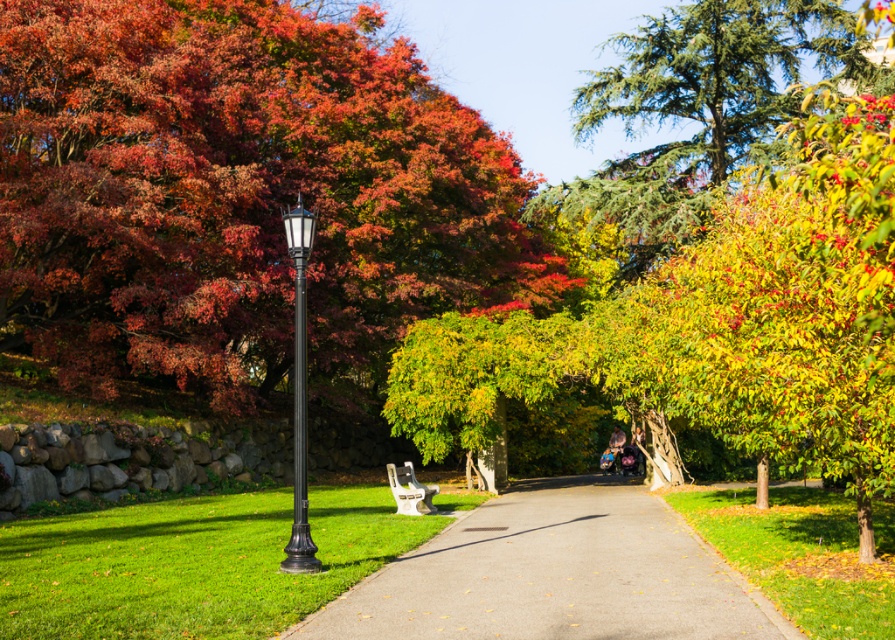
Does smooth asphalt path at center have a greater width compared to white plastic bench at center?

Yes.

Is point (638, 532) closer to camera compared to point (394, 493)?

Yes.

Which is in front, point (458, 550) or point (411, 508)?

Point (458, 550) is more forward.

Locate an element on the screen. The image size is (895, 640). smooth asphalt path at center is located at coordinates (555, 576).

Can you confirm if autumn leaves at upper left is bigger than black metal lamp post at left?

Correct, autumn leaves at upper left is larger in size than black metal lamp post at left.

Can you confirm if autumn leaves at upper left is positioned below black metal lamp post at left?

No, autumn leaves at upper left is not below black metal lamp post at left.

Who is more distant from viewer, (362, 288) or (297, 285)?

The point (362, 288) is behind.

I want to click on autumn leaves at upper left, so click(239, 196).

This screenshot has height=640, width=895. What do you see at coordinates (239, 196) in the screenshot?
I see `autumn leaves at upper left` at bounding box center [239, 196].

Between autumn leaves at upper left and white plastic bench at center, which one is positioned lower?

Positioned lower is white plastic bench at center.

Which is behind, point (145, 177) or point (419, 499)?

Positioned behind is point (145, 177).

Locate an element on the screen. This screenshot has height=640, width=895. autumn leaves at upper left is located at coordinates (239, 196).